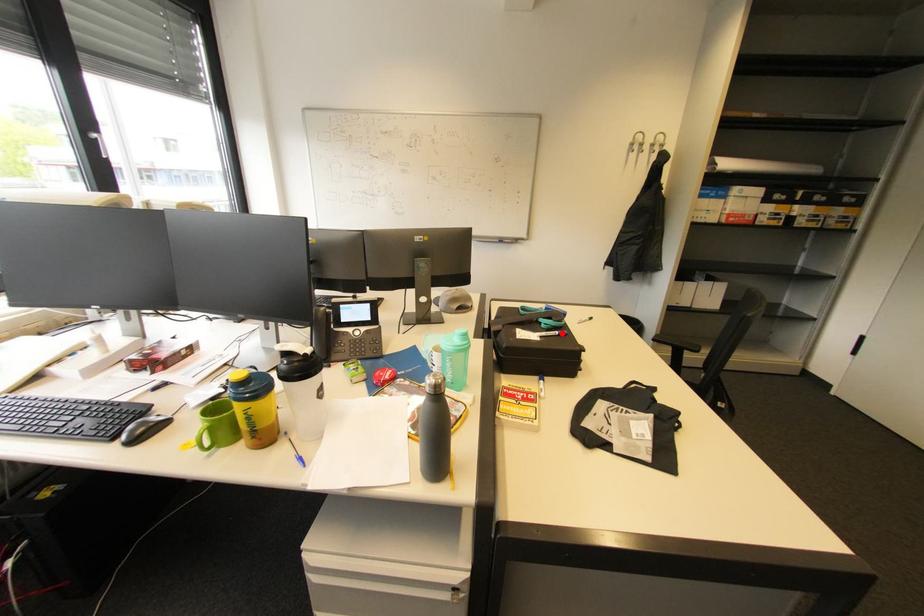
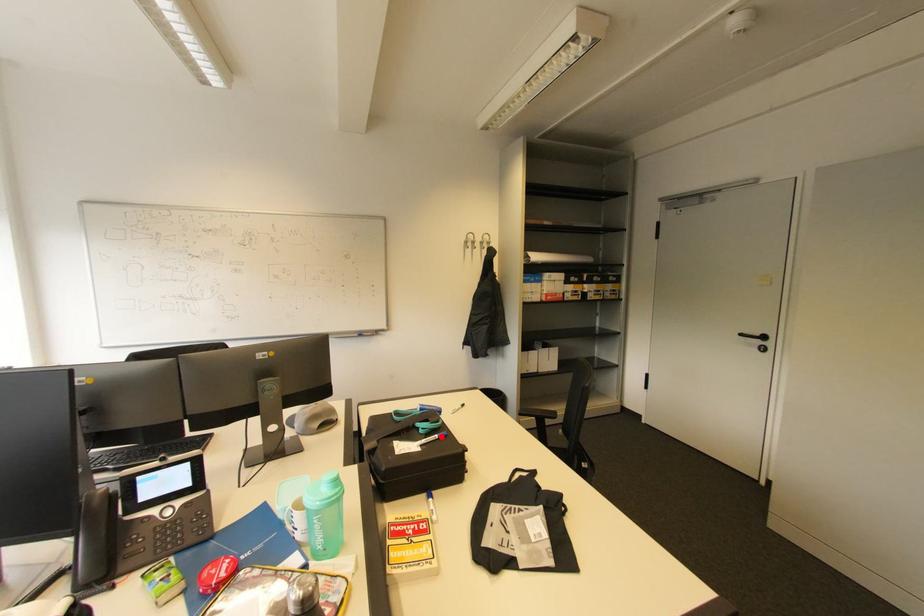
I am providing you with two images of the same scene from different viewpoints. A red point is marked on the first image and another point is marked on the second image. Does the point marked in image1 correspond to the same location as the one in image2?

Yes